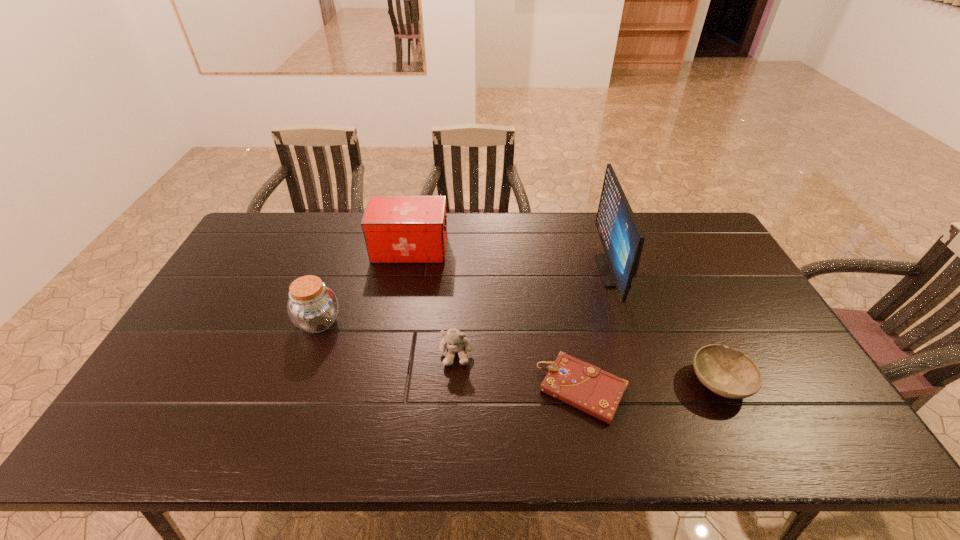
The height and width of the screenshot is (540, 960). Find the location of `free location that satisfies the following two spatial constraints: 1. on the handle side of the second object from left to right; 2. on the left side of the rightmost object`. free location that satisfies the following two spatial constraints: 1. on the handle side of the second object from left to right; 2. on the left side of the rightmost object is located at coordinates (385, 382).

Find the location of a particular element. This screenshot has height=540, width=960. vacant space that satisfies the following two spatial constraints: 1. on the face of the third shortest object; 2. on the left side of the bowl is located at coordinates (454, 382).

Identify the location of free region that satisfies the following two spatial constraints: 1. on the handle side of the rightmost object; 2. on the right side of the first-aid kit. (385, 382).

I want to click on free location that satisfies the following two spatial constraints: 1. on the handle side of the bowl; 2. on the left side of the first-aid kit, so click(x=385, y=382).

Where is `free region that satisfies the following two spatial constraints: 1. on the screen side of the fifth object from left to right; 2. on the front side of the jar`? free region that satisfies the following two spatial constraints: 1. on the screen side of the fifth object from left to right; 2. on the front side of the jar is located at coordinates (630, 322).